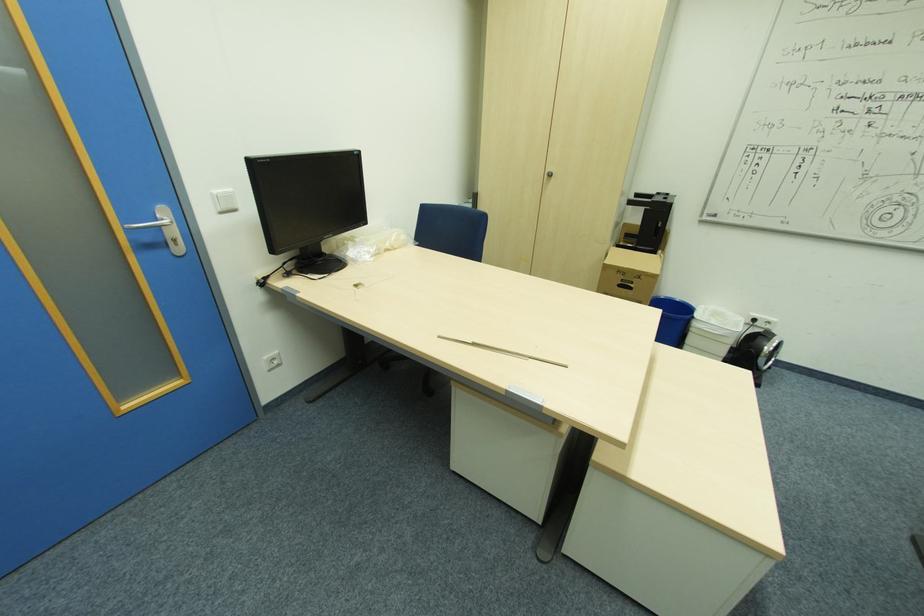
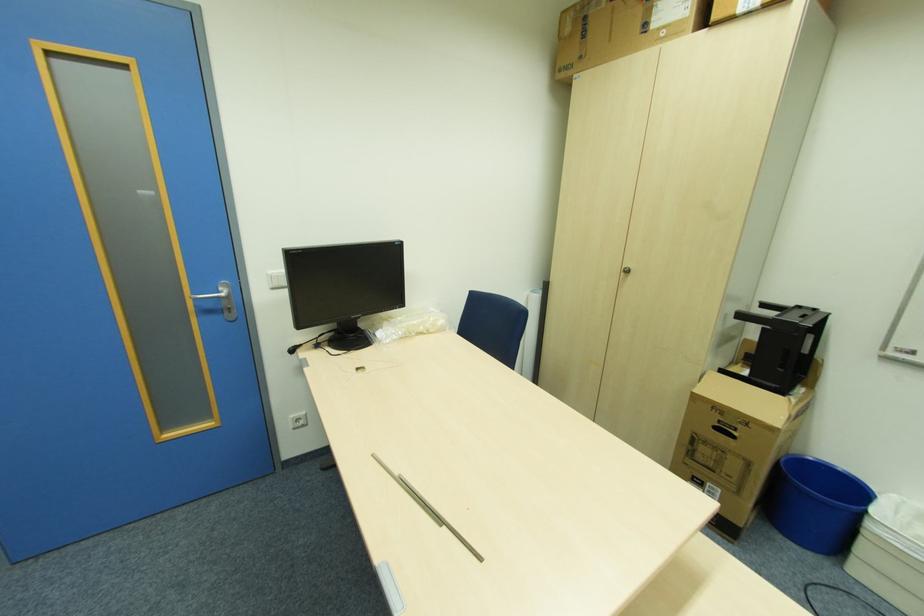
In the second image, find the point that corresponds to point 297,267 in the first image.

(330, 339)